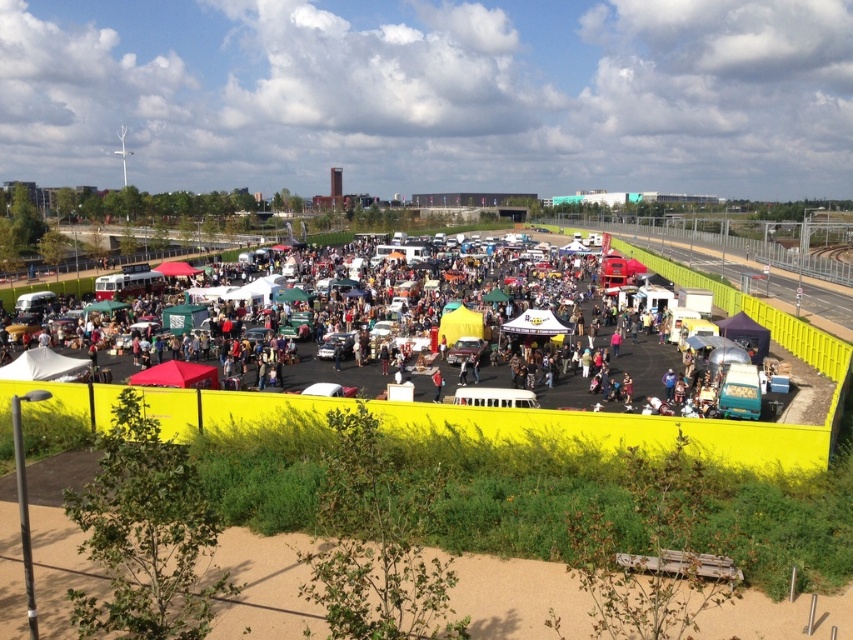
Question: Which of these objects is positioned farthest from the matte black tent at center?

Choices:
 (A) white fabric canopy at lower left
 (B) matte red canopy at lower left
 (C) white fabric canopy at center

Answer: (A)

Question: Which point is farther from the camera taking this photo?

Choices:
 (A) (798, 336)
 (B) (144, 372)

Answer: (A)

Question: Does white fabric canopy at lower left have a lesser width compared to white fabric canopy at center?

Choices:
 (A) no
 (B) yes

Answer: (A)

Question: Does matte black tent at center appear over white fabric canopy at lower left?

Choices:
 (A) no
 (B) yes

Answer: (B)

Question: Which of the following is the farthest from the observer?

Choices:
 (A) white fabric canopy at lower left
 (B) matte black tent at center
 (C) white fabric canopy at center
 (D) matte red canopy at lower left

Answer: (C)

Question: Can you confirm if matte red canopy at lower left is wider than white fabric canopy at center?

Choices:
 (A) no
 (B) yes

Answer: (B)